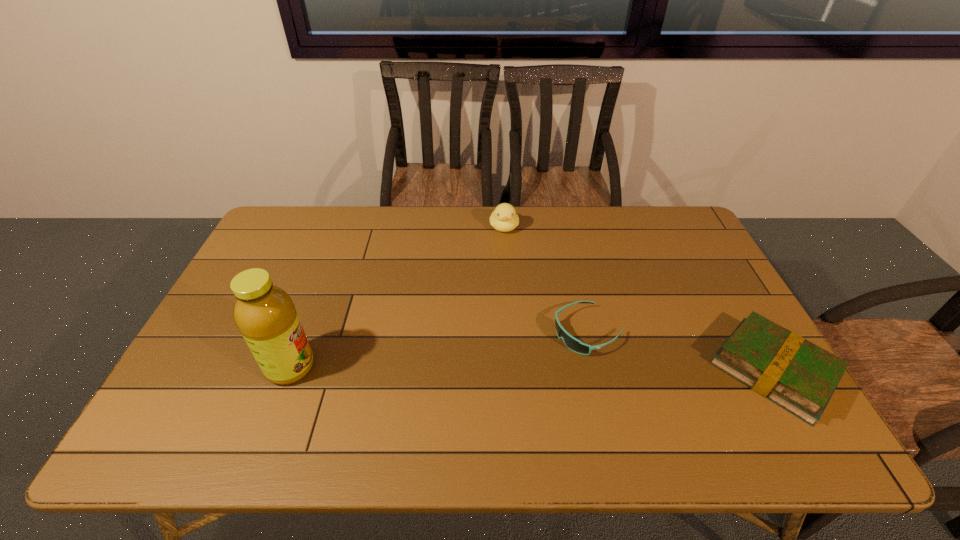
Where is `the tallest object`? This screenshot has width=960, height=540. the tallest object is located at coordinates (265, 315).

Locate an element on the screen. fruit juice is located at coordinates (x=265, y=315).

Find the location of `the third tallest object`. the third tallest object is located at coordinates (799, 376).

The image size is (960, 540). What are the coordinates of `book` in the screenshot? It's located at (799, 376).

Identify the location of the farthest object. (504, 218).

This screenshot has width=960, height=540. I want to click on duckling, so click(x=504, y=218).

Locate an element on the screen. the shortest object is located at coordinates (572, 343).

The height and width of the screenshot is (540, 960). I want to click on the second object from right to left, so click(x=572, y=343).

At what (x,y) coordinates should I click in order to perform the action: click on free region located on the front label of the leftmost object. Please return your answer as a coordinate pair (x, y). The width and height of the screenshot is (960, 540). Looking at the image, I should click on point(398,367).

The height and width of the screenshot is (540, 960). I want to click on vacant area situated on the left of the third tallest object, so click(x=564, y=370).